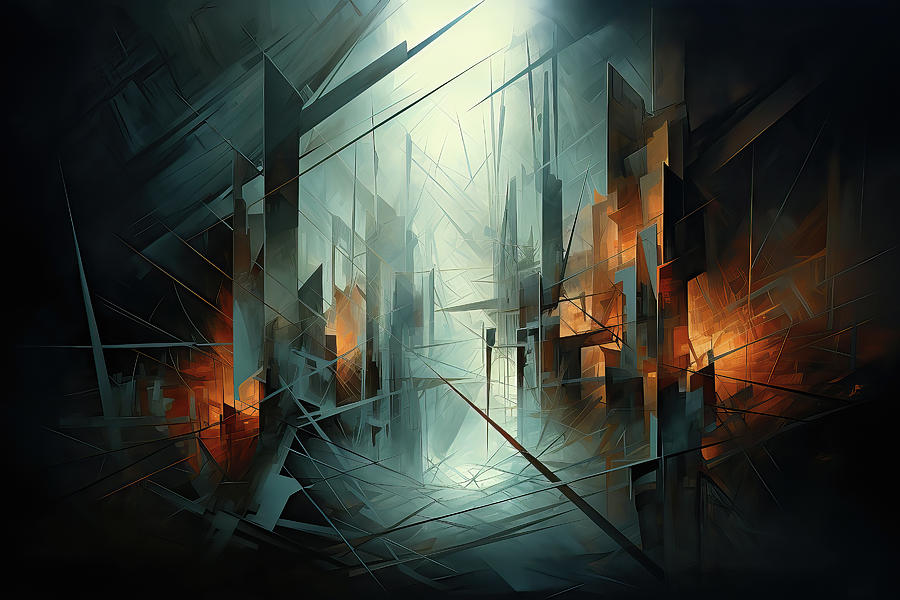
Where is `wall`? wall is located at coordinates (146, 273), (840, 338).